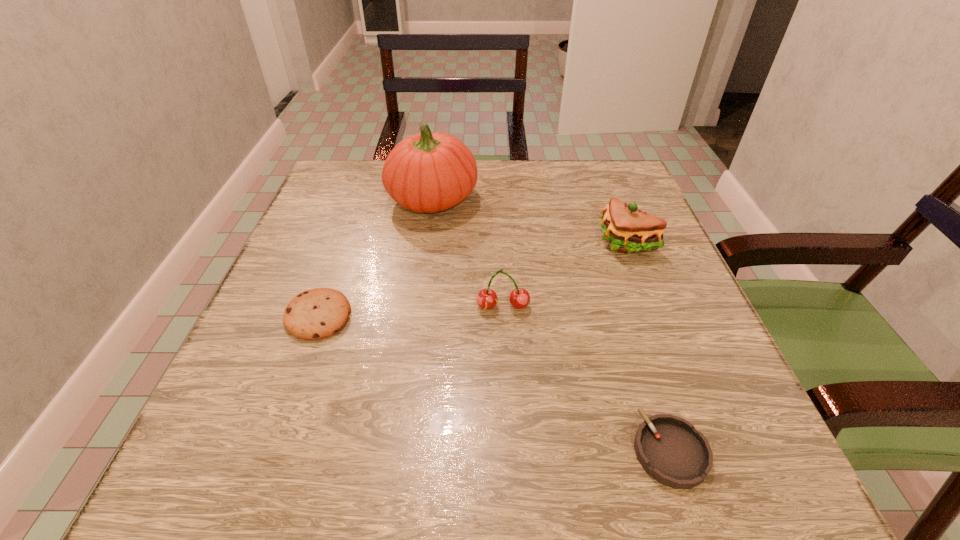
The image size is (960, 540). Identify the location of free space located on the back of the ashtray. (604, 246).

Locate an element on the screen. This screenshot has width=960, height=540. object that is at the far edge is located at coordinates (429, 172).

Identify the location of object that is at the near edge. Image resolution: width=960 pixels, height=540 pixels. (669, 448).

At what (x,y) coordinates should I click in order to perform the action: click on object present at the left edge. Please return your answer as a coordinate pair (x, y). Image resolution: width=960 pixels, height=540 pixels. Looking at the image, I should click on (318, 313).

In order to click on sandwich at the right edge in this screenshot , I will do `click(627, 229)`.

This screenshot has width=960, height=540. I want to click on ashtray that is at the right edge, so click(x=669, y=448).

Image resolution: width=960 pixels, height=540 pixels. What are the coordinates of `object at the near right corner` in the screenshot? It's located at (669, 448).

You are a GUI agent. You are given a task and a screenshot of the screen. Output one action in this format:
    pyautogui.click(x=<x>, y=<y>)
    Task: Click on the vacant region at the far edge of the desktop
    The height and width of the screenshot is (540, 960).
    Given the screenshot: What is the action you would take?
    pyautogui.click(x=475, y=188)

Identify the location of vacant region at the near edge of the desktop. The image size is (960, 540). (431, 438).

You are a GUI agent. You are given a task and a screenshot of the screen. Output one action in this format:
    pyautogui.click(x=<x>, y=<y>)
    Task: Click on the vacant space at the left edge
    Image resolution: width=960 pixels, height=540 pixels.
    Given the screenshot: What is the action you would take?
    pyautogui.click(x=337, y=227)